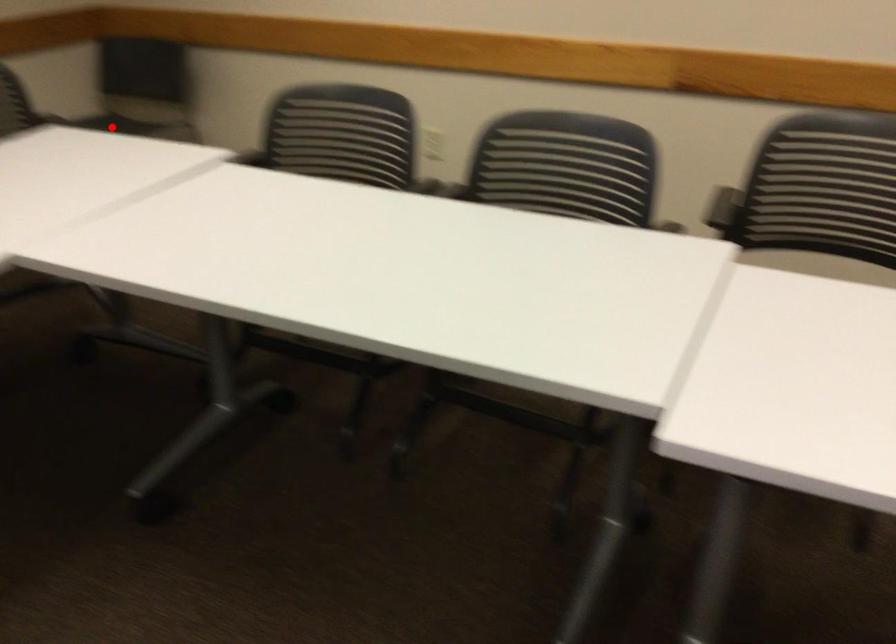
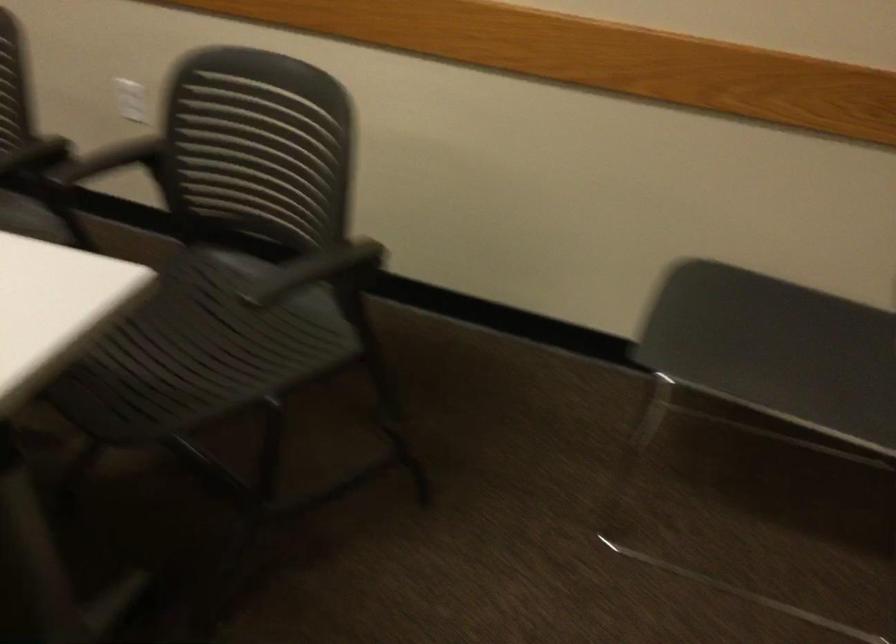
Question: I am providing you with two images of the same scene from different viewpoints. In image1, a red point is highlighted. Considering the same 3D point in image2, which of the following is correct?

Choices:
 (A) It is closer
 (B) It is farther

Answer: (A)